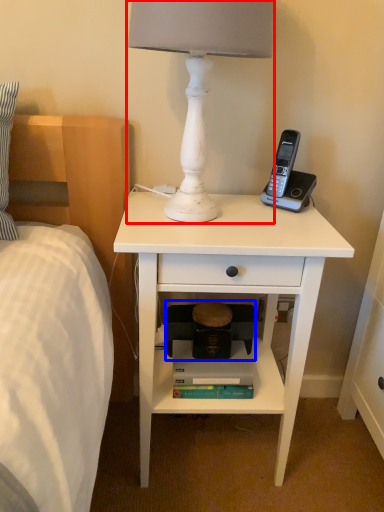
Question: Which of the following is the farthest to the observer, lamp (highlighted by a red box) or step stool (highlighted by a blue box)?

Choices:
 (A) lamp
 (B) step stool

Answer: (B)